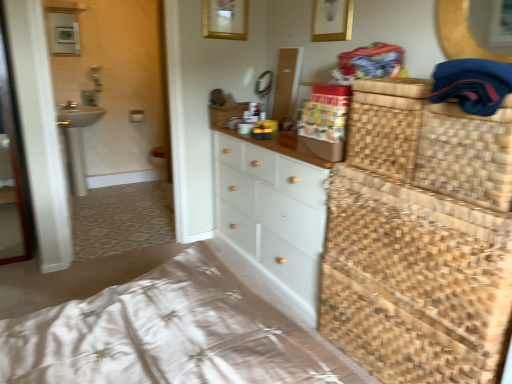
Question: In terms of size, does transparent glass screen door at left appear bigger or smaller than dark blue fabric at upper right?

Choices:
 (A) small
 (B) big

Answer: (A)

Question: Would you say transparent glass screen door at left is to the left or to the right of dark blue fabric at upper right in the picture?

Choices:
 (A) left
 (B) right

Answer: (A)

Question: Based on their relative distances, which object is farther from the gold metallic picture frame at upper center?

Choices:
 (A) white painted wood chest of drawers at center
 (B) matte white medicine cabinet at upper left
 (C) woven wood bed frame at lower right
 (D) woven straw basket at center, which ranks as the 1th basket in top-to-bottom order
 (E) white ceramic sink at left

Answer: (E)

Question: Which is farther from the woven brown basket at right, positioned as the first basket in bottom-to-top order?

Choices:
 (A) transparent glass screen door at left
 (B) woven wood bed frame at lower right
 (C) white painted wood chest of drawers at center
 (D) white ceramic sink at left
 (E) woven straw basket at center, which is counted as the second basket, starting from the front

Answer: (D)